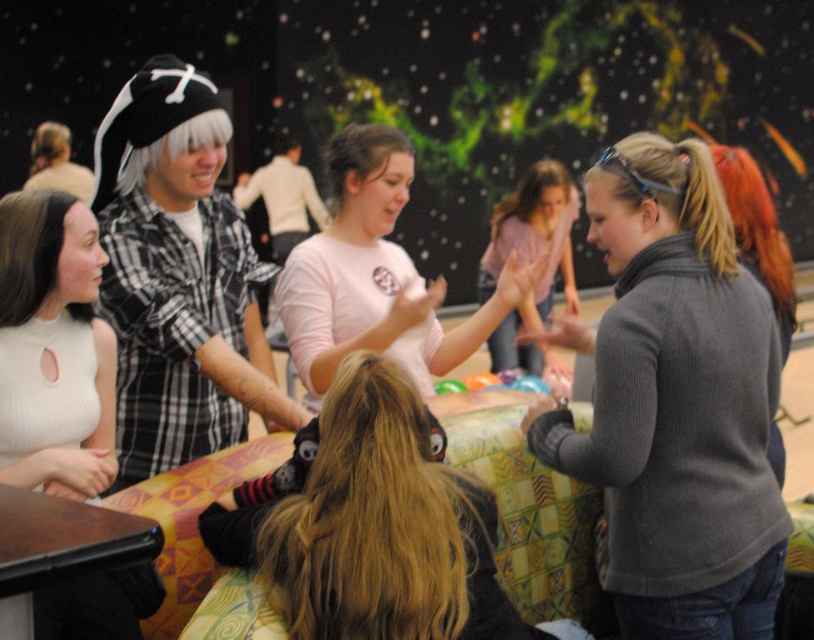
Who is taller, gray sweater at right or blonde hair at center?

gray sweater at right is taller.

Can you confirm if gray sweater at right is positioned to the right of blonde hair at center?

Indeed, gray sweater at right is positioned on the right side of blonde hair at center.

At what (x,y) coordinates should I click in order to perform the action: click on gray sweater at right. Please return your answer as a coordinate pair (x, y). Looking at the image, I should click on (675, 403).

Can you confirm if white matte shirt at left is wider than pink matte shirt at center?

In fact, white matte shirt at left might be narrower than pink matte shirt at center.

Which is in front, point (90, 429) or point (353, 321)?

Point (90, 429) is more forward.

Who is more distant from viewer, [55,205] or [337,339]?

The point [337,339] is more distant.

This screenshot has width=814, height=640. I want to click on white matte shirt at left, so point(53,348).

Who is positioned more to the left, white matte shirt at left or matte black pirate hat at upper left?

Positioned to the left is matte black pirate hat at upper left.

Can you confirm if white matte shirt at left is smaller than matte black pirate hat at upper left?

Yes, white matte shirt at left is smaller than matte black pirate hat at upper left.

Is point (58, 385) positioned in front of point (68, 132)?

Yes.

Image resolution: width=814 pixels, height=640 pixels. I want to click on white matte shirt at left, so click(x=53, y=348).